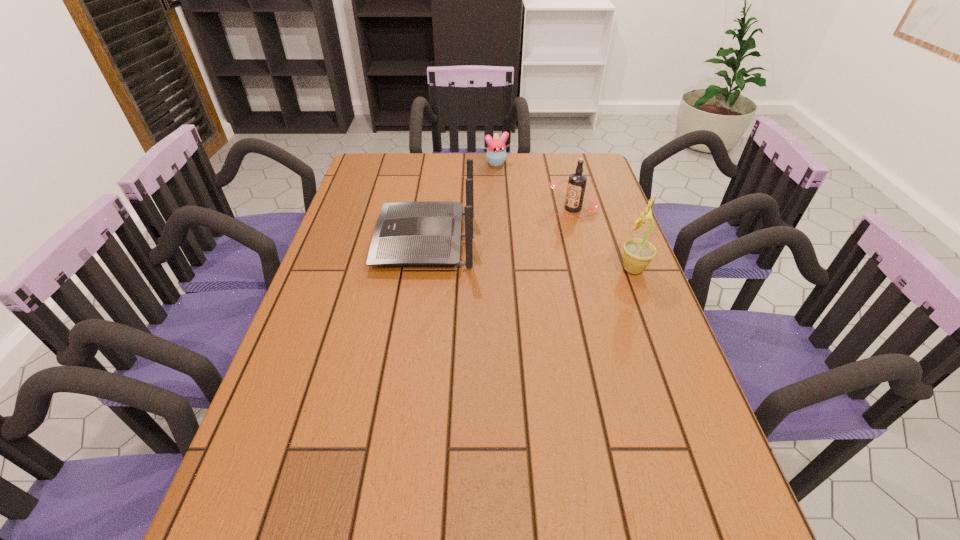
The width and height of the screenshot is (960, 540). In order to click on free space on the desktop that is between the router and the sunflower and is positioned on the label of the third tallest object in this screenshot , I will do `click(506, 252)`.

Find the location of a particular element. This screenshot has height=540, width=960. vacant spot on the desktop that is between the leftmost object and the sunflower and is positioned on the face of the farthest object is located at coordinates (552, 258).